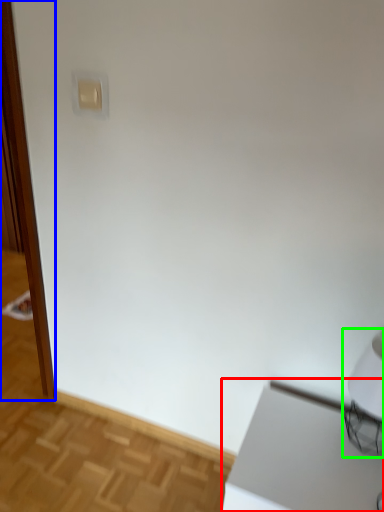
Question: Which object is positioned closest to table (highlighted by a red box)? Select from screen door (highlighted by a blue box) and table lamp (highlighted by a green box).

Choices:
 (A) screen door
 (B) table lamp

Answer: (B)